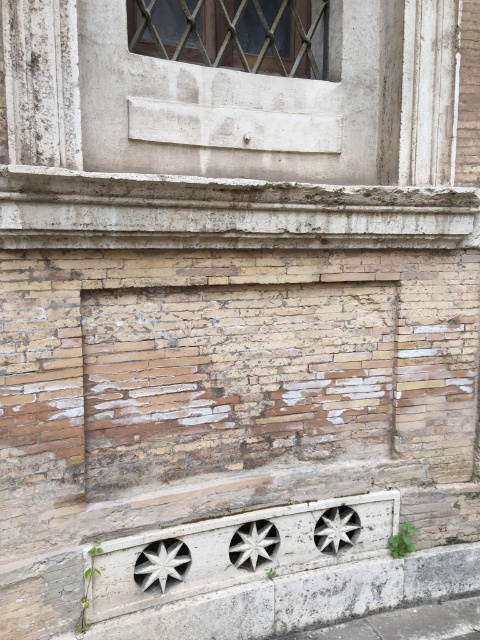
Consider the image. Which of these two, metallic gridwork window at upper center or gray concrete pavement at lower center, stands shorter?

gray concrete pavement at lower center

You are a GUI agent. You are given a task and a screenshot of the screen. Output one action in this format:
    pyautogui.click(x=<x>, y=<y>)
    Task: Click on the metallic gridwork window at upper center
    This screenshot has width=480, height=640.
    Given the screenshot: What is the action you would take?
    pyautogui.click(x=231, y=33)

Does white concrete curb at lower center lie behind metallic gridwork window at upper center?

No.

The image size is (480, 640). What do you see at coordinates (301, 598) in the screenshot? I see `white concrete curb at lower center` at bounding box center [301, 598].

You are a GUI agent. You are given a task and a screenshot of the screen. Output one action in this format:
    pyautogui.click(x=<x>, y=<y>)
    Task: Click on the white concrete curb at lower center
    This screenshot has width=480, height=640.
    Given the screenshot: What is the action you would take?
    pyautogui.click(x=301, y=598)

Where is `white concrete curb at lower center`? white concrete curb at lower center is located at coordinates (301, 598).

Is white concrete curb at lower center wider than gray concrete pavement at lower center?

Yes.

Does point (222, 630) come farther from viewer compared to point (358, 630)?

No.

Which is behind, point (220, 609) or point (451, 634)?

Positioned behind is point (451, 634).

Find the location of a particular element. The width and height of the screenshot is (480, 640). white concrete curb at lower center is located at coordinates (301, 598).